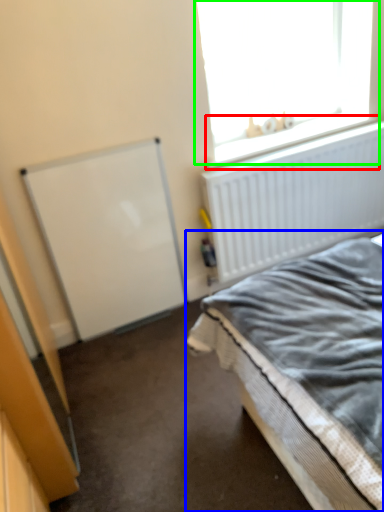
Question: Which object is positioned farthest from window sill (highlighted by a red box)? Select from bed (highlighted by a blue box) and window (highlighted by a green box).

Choices:
 (A) bed
 (B) window

Answer: (A)